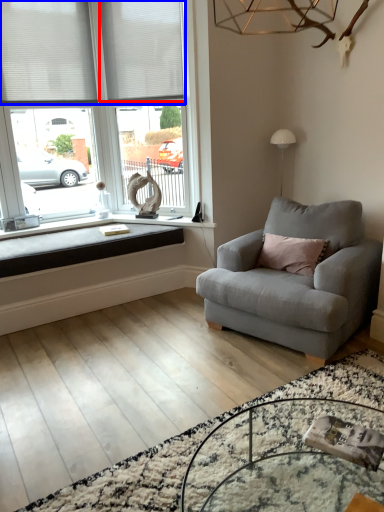
Question: Which object is further to the camera taking this photo, blind (highlighted by a red box) or blind (highlighted by a blue box)?

Choices:
 (A) blind
 (B) blind

Answer: (A)